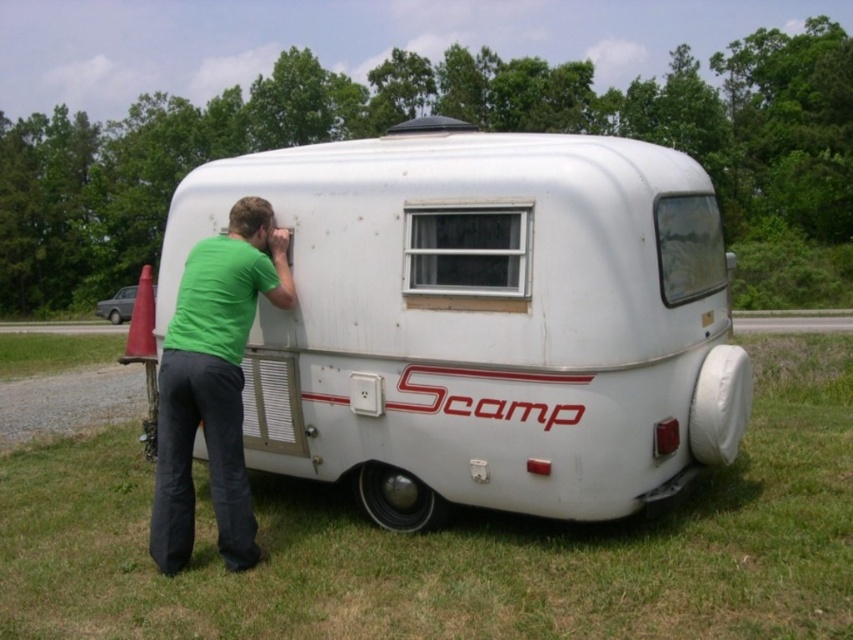
You are a delivery person who needs to park your van between the white matte recreational vehicle at center and the white matte trailer at lower left. Based on their positions, can you fit your van there?

The white matte recreational vehicle at center is below the white matte trailer at lower left, so there is no space between them for the van to park.

You are standing in the campground and see the white matte recreational vehicle at center and the green matte shirt at lower left. Which object is positioned higher in the image?

The white matte recreational vehicle at center is positioned higher than the green matte shirt at lower left.

Based on the photo, based on the scene description, what are the coordinates of the white matte recreational vehicle at center?

The white matte recreational vehicle at center is located at coordinates point (x=483, y=321).